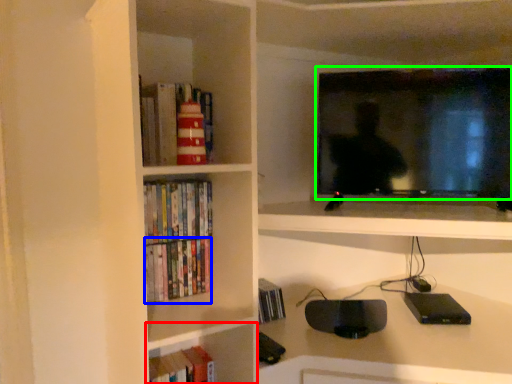
Question: Considering the real-world distances, which object is closest to shelf (highlighted by a red box)? book (highlighted by a blue box) or television (highlighted by a green box).

Choices:
 (A) book
 (B) television

Answer: (A)